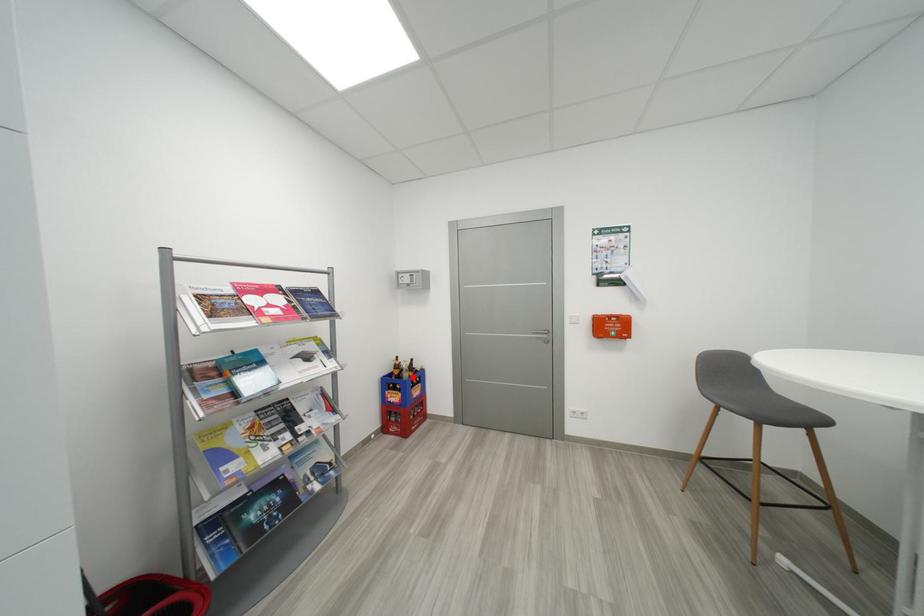
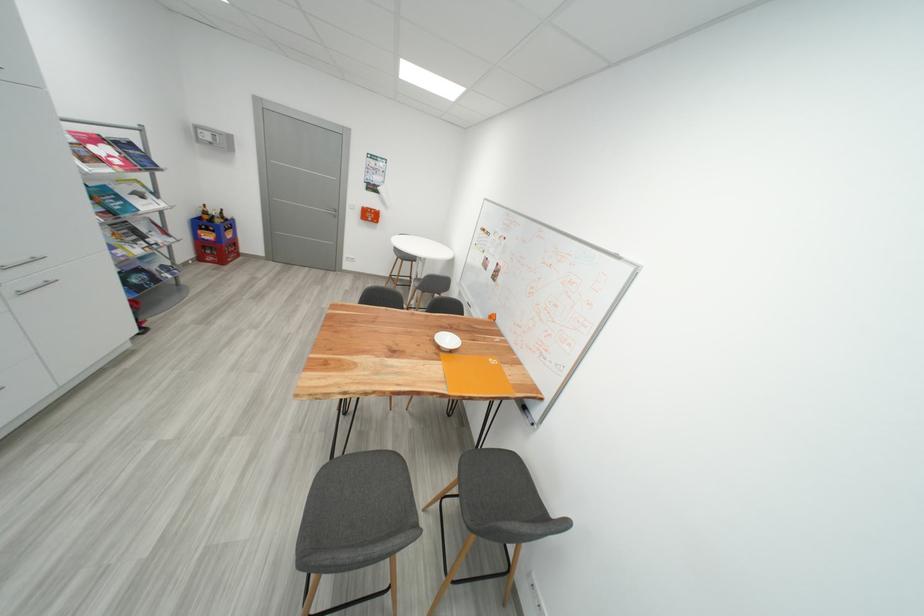
Locate, in the second image, the point that corresponds to the highlighted location in the first image.

(225, 223)